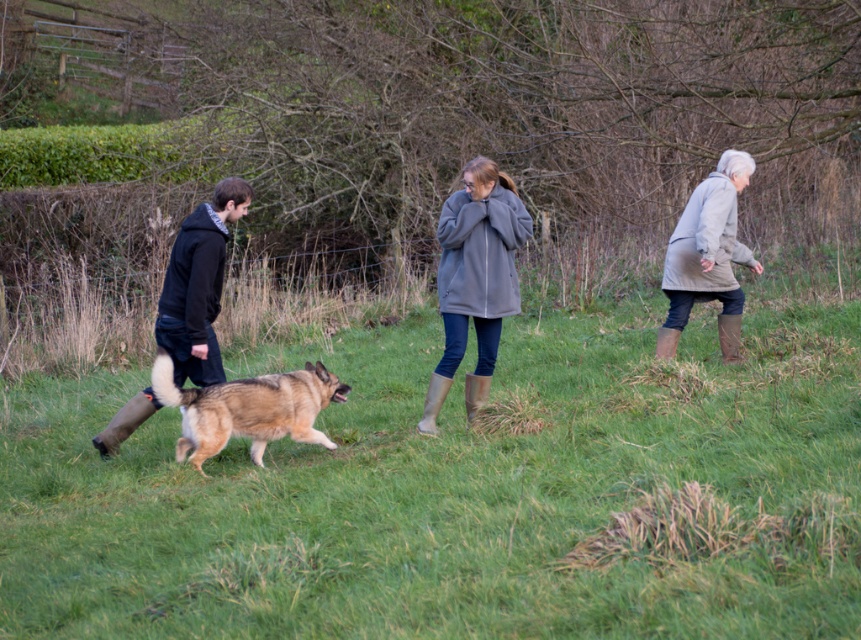
Question: Among these points, which one is nearest to the camera?

Choices:
 (A) (290, 580)
 (B) (180, 244)

Answer: (A)

Question: Is gray fleece jacket at center further to camera compared to brown fur dog at center?

Choices:
 (A) yes
 (B) no

Answer: (A)

Question: Is brown fur dog at center closer to camera compared to light gray coat at right?

Choices:
 (A) no
 (B) yes

Answer: (B)

Question: Which of these objects is positioned closest to the green grassy field at center?

Choices:
 (A) brown fur dog at center
 (B) light gray coat at right
 (C) gray fleece jacket at center

Answer: (A)

Question: Observing the image, what is the correct spatial positioning of brown fur dog at center in reference to light gray coat at right?

Choices:
 (A) below
 (B) above

Answer: (A)

Question: Estimate the real-world distances between objects in this image. Which object is farther from the gray fleece jacket at center?

Choices:
 (A) brown fur dog at center
 (B) light gray coat at right
 (C) green grassy field at center

Answer: (B)